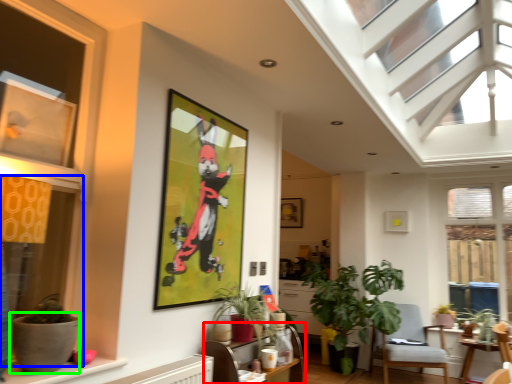
Question: Considering the real-world distances, which object is farthest from table (highlighted by a red box)? window (highlighted by a blue box) or flowerpot (highlighted by a green box)?

Choices:
 (A) window
 (B) flowerpot

Answer: (A)